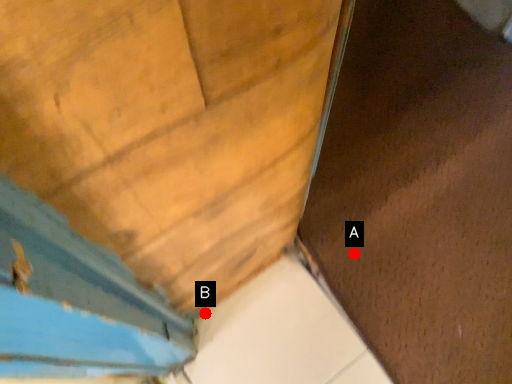
Question: Two points are circled on the image, labeled by A and B beside each circle. Which point is closer to the camera?

Choices:
 (A) A is closer
 (B) B is closer

Answer: (B)